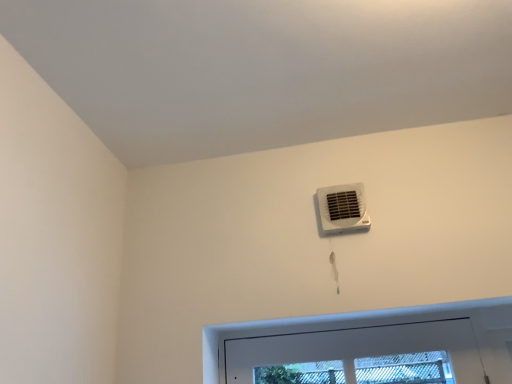
What do you see at coordinates (343, 208) in the screenshot? I see `white plastic air conditioning at upper center` at bounding box center [343, 208].

What are the coordinates of `white plastic air conditioning at upper center` in the screenshot? It's located at (343, 208).

The width and height of the screenshot is (512, 384). What are the coordinates of `white plastic air conditioning at upper center` in the screenshot? It's located at (343, 208).